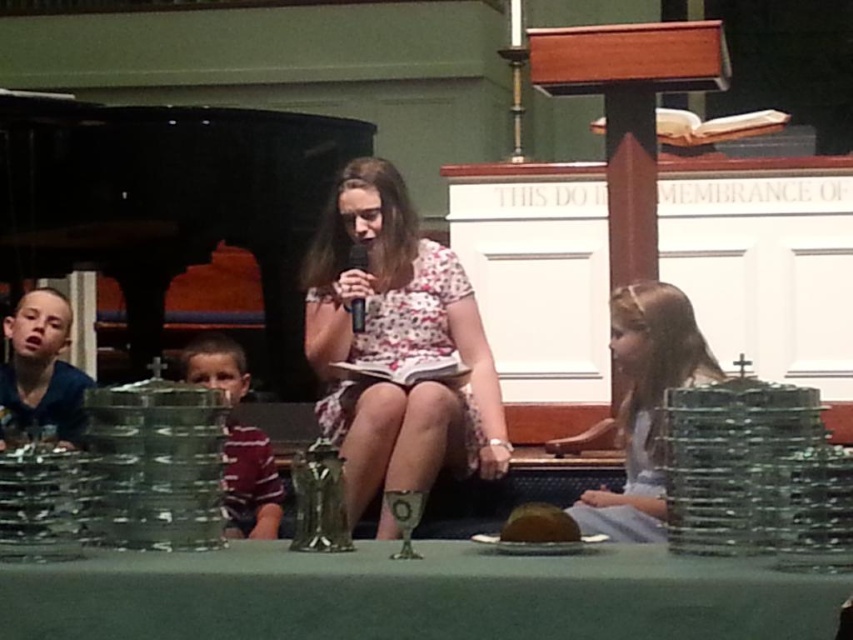
Question: Which of the following is the farthest from the observer?

Choices:
 (A) blue cotton shirt at left
 (B) striped fabric shirt at left

Answer: (A)

Question: Is green felt table at center wider than blue cotton shirt at left?

Choices:
 (A) yes
 (B) no

Answer: (A)

Question: Which object appears closest to the camera in this image?

Choices:
 (A) blue cotton shirt at left
 (B) black plastic microphone at center
 (C) striped fabric shirt at left
 (D) light blue fabric dress at center

Answer: (D)

Question: Does blue cotton shirt at left lie behind black plastic microphone at center?

Choices:
 (A) no
 (B) yes

Answer: (B)

Question: Which object appears closest to the camera in this image?

Choices:
 (A) green felt table at center
 (B) white floral dress at center
 (C) blue cotton shirt at left
 (D) light blue fabric dress at center

Answer: (A)

Question: Observing the image, what is the correct spatial positioning of blue cotton shirt at left in reference to black plastic microphone at center?

Choices:
 (A) above
 (B) below

Answer: (B)